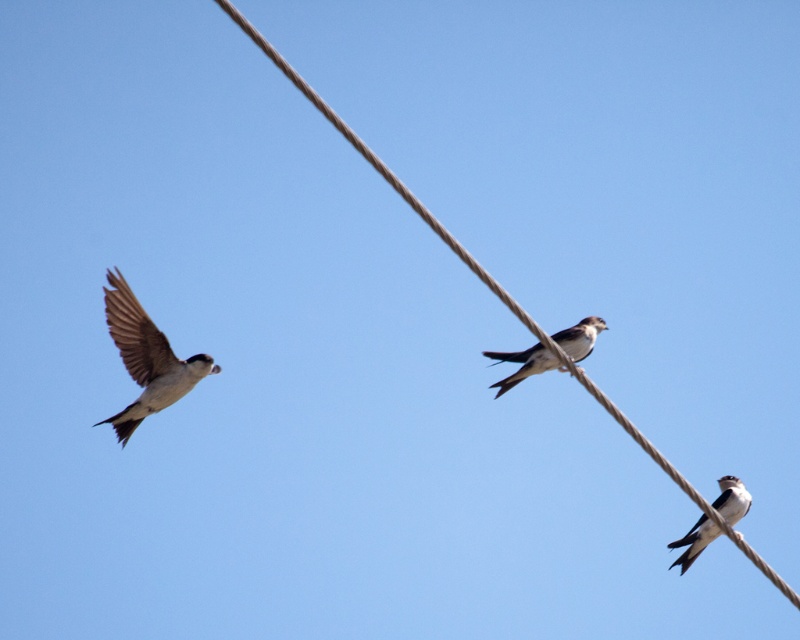
Between point (166, 396) and point (674, 563), which one is positioned behind?

The point (674, 563) is behind.

Who is positioned more to the left, white glossy swallow at left or white matte bird at center?

Positioned to the left is white glossy swallow at left.

This screenshot has height=640, width=800. Identify the location of white glossy swallow at left. (146, 358).

The width and height of the screenshot is (800, 640). Find the location of `white glossy swallow at left`. white glossy swallow at left is located at coordinates (146, 358).

Looking at this image, who is taller, brown rope wire at center or white glossy swallow at left?

brown rope wire at center

Does point (388, 172) come in front of point (178, 381)?

Yes, point (388, 172) is closer to viewer.

Where is `brown rope wire at center`? brown rope wire at center is located at coordinates [384, 172].

Is brown rope wire at center smaller than white glossy swallow at center?

Actually, brown rope wire at center might be larger than white glossy swallow at center.

Looking at this image, is brown rope wire at center below white glossy swallow at center?

No, brown rope wire at center is not below white glossy swallow at center.

Describe the element at coordinates (384, 172) in the screenshot. I see `brown rope wire at center` at that location.

You are a GUI agent. You are given a task and a screenshot of the screen. Output one action in this format:
    pyautogui.click(x=<x>, y=<y>)
    Task: Click on the brown rope wire at center
    The width and height of the screenshot is (800, 640).
    Given the screenshot: What is the action you would take?
    pyautogui.click(x=384, y=172)